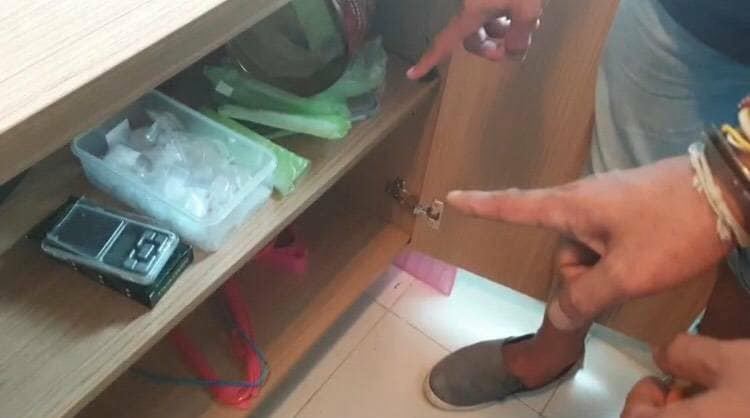
The width and height of the screenshot is (750, 418). Identify the location of cupboard door. (520, 139).